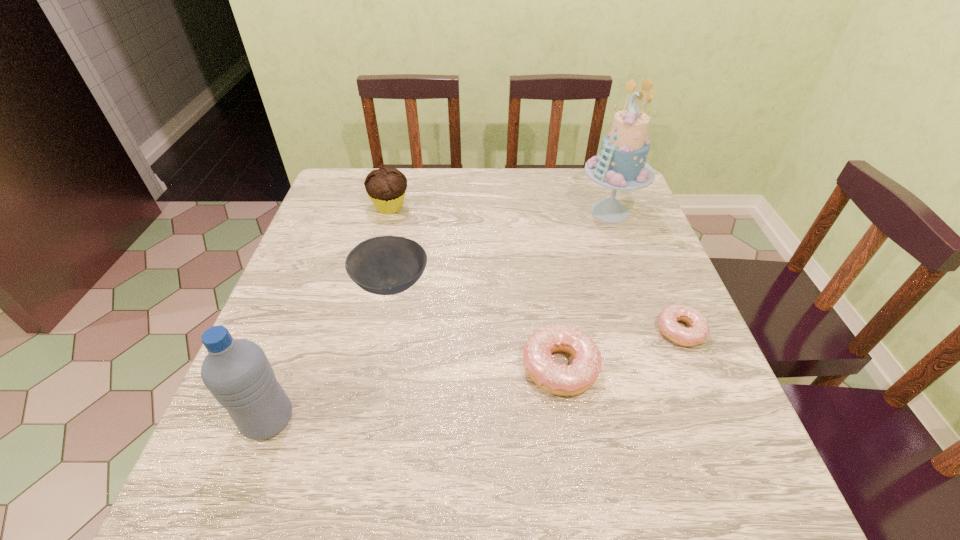
Image resolution: width=960 pixels, height=540 pixels. Find the location of `water bottle present at the near edge`. water bottle present at the near edge is located at coordinates (237, 372).

I want to click on bowl that is at the left edge, so click(386, 265).

Where is `muffin that is at the left edge`? muffin that is at the left edge is located at coordinates (386, 186).

Identify the location of water bottle that is at the left edge. (237, 372).

At what (x,y) coordinates should I click in order to perform the action: click on doughnut that is at the right edge. Please return your answer as a coordinate pair (x, y). Image resolution: width=960 pixels, height=540 pixels. Looking at the image, I should click on (668, 324).

What are the coordinates of `cake that is at the right edge` in the screenshot? It's located at click(621, 165).

Where is `object located in the far left corner section of the desktop`? The width and height of the screenshot is (960, 540). object located in the far left corner section of the desktop is located at coordinates (386, 186).

You are a GUI agent. You are given a task and a screenshot of the screen. Output one action in this format:
    pyautogui.click(x=<x>, y=<y>)
    Task: Click on the object situated at the near left corner
    
    Given the screenshot: What is the action you would take?
    pyautogui.click(x=237, y=372)

What are the coordinates of `object that is at the far right corner` in the screenshot? It's located at (621, 165).

Locate an element on the screen. vacant region at the far edge of the desktop is located at coordinates (420, 191).